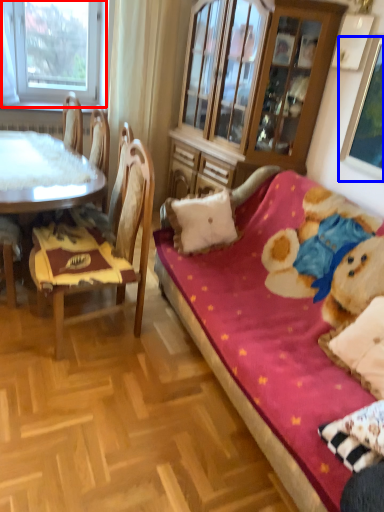
Question: Which object is closer to the camera taking this photo, window (highlighted by a red box) or picture frame (highlighted by a blue box)?

Choices:
 (A) window
 (B) picture frame

Answer: (B)